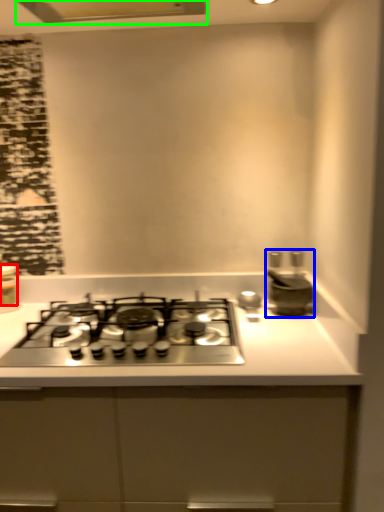
Question: Estimate the real-world distances between objects in this image. Which object is farther from kitchen appliance (highlighted by a red box), appliance (highlighted by a blue box) or exhaust hood (highlighted by a green box)?

Choices:
 (A) appliance
 (B) exhaust hood

Answer: (A)